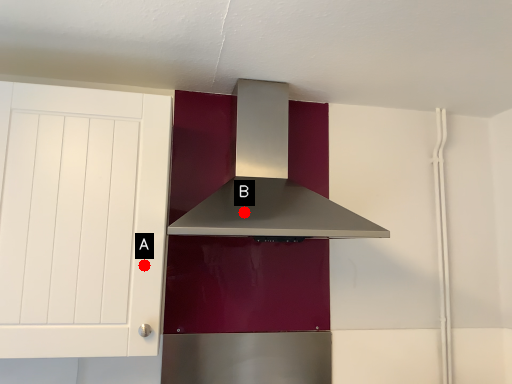
Question: Two points are circled on the image, labeled by A and B beside each circle. Which of the following is the closest to the observer?

Choices:
 (A) A is closer
 (B) B is closer

Answer: (A)